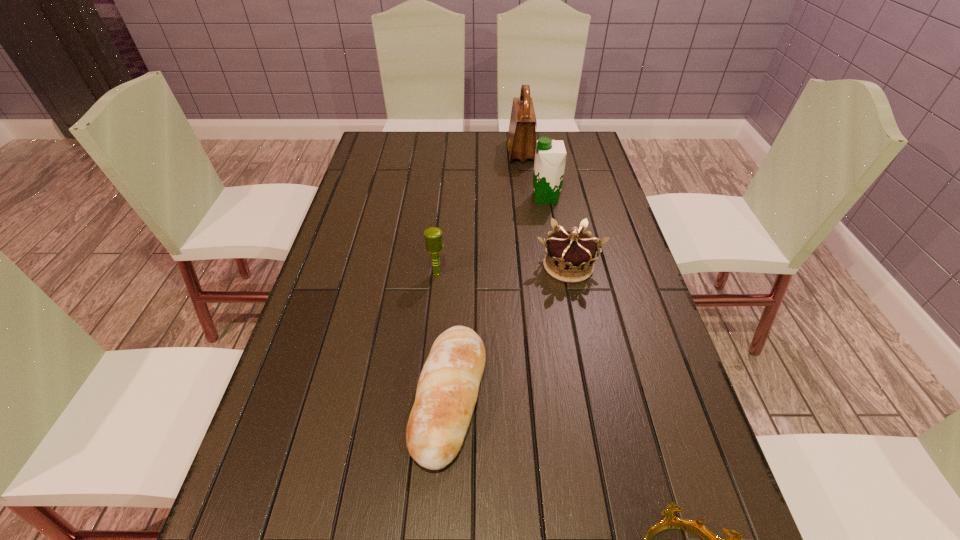
Identify the location of the tallest object. (521, 145).

You are a GUI agent. You are given a task and a screenshot of the screen. Output one action in this format:
    pyautogui.click(x=<x>, y=<y>)
    Task: Click on the shoulder bag
    The height and width of the screenshot is (540, 960).
    Given the screenshot: What is the action you would take?
    pyautogui.click(x=521, y=145)

The width and height of the screenshot is (960, 540). Find the location of `soya milk`. soya milk is located at coordinates (550, 157).

Where is `the second tallest object`? The height and width of the screenshot is (540, 960). the second tallest object is located at coordinates (550, 157).

Where is `microphone`? This screenshot has height=540, width=960. microphone is located at coordinates (433, 236).

The width and height of the screenshot is (960, 540). Identify the location of the taller crown. (570, 255).

At what (x,y) coordinates should I click in order to perform the action: click on the second shortest object. Please return your answer as a coordinate pair (x, y). Looking at the image, I should click on (447, 390).

Find the location of a particular element. The width and height of the screenshot is (960, 540). bread is located at coordinates (447, 390).

Where is `vacant space located 0.380m on the front flap of the farthest object`? This screenshot has height=540, width=960. vacant space located 0.380m on the front flap of the farthest object is located at coordinates (406, 152).

Where is `vacant space located 0.330m on the front flap of the farthest object`? The image size is (960, 540). vacant space located 0.330m on the front flap of the farthest object is located at coordinates (420, 152).